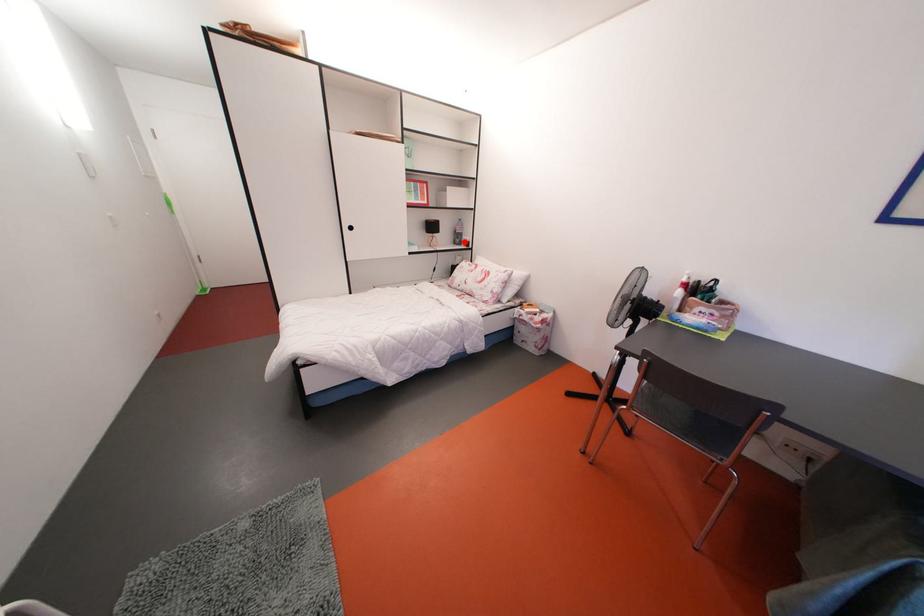
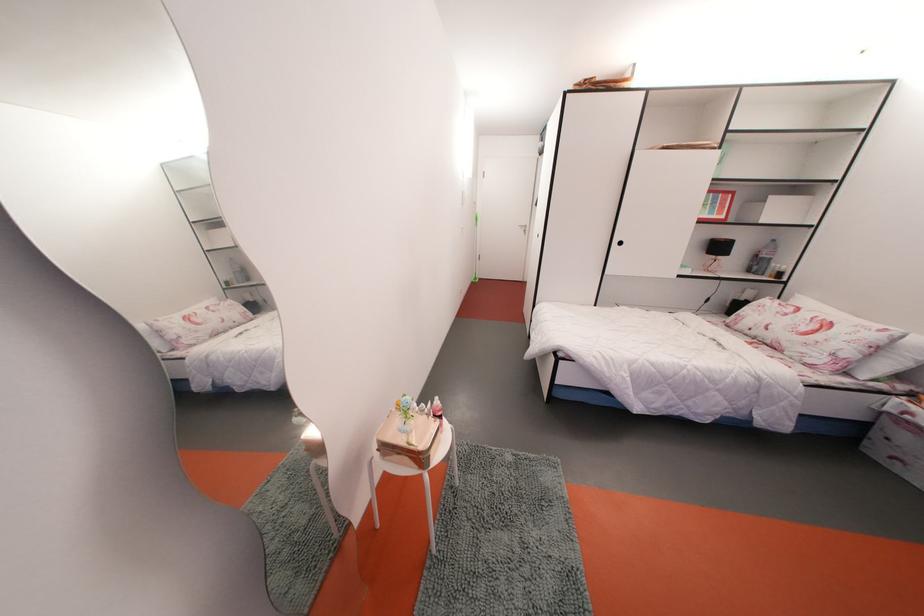
Locate, in the second image, the point that corresponds to the highlighted location in the first image.

(764, 268)